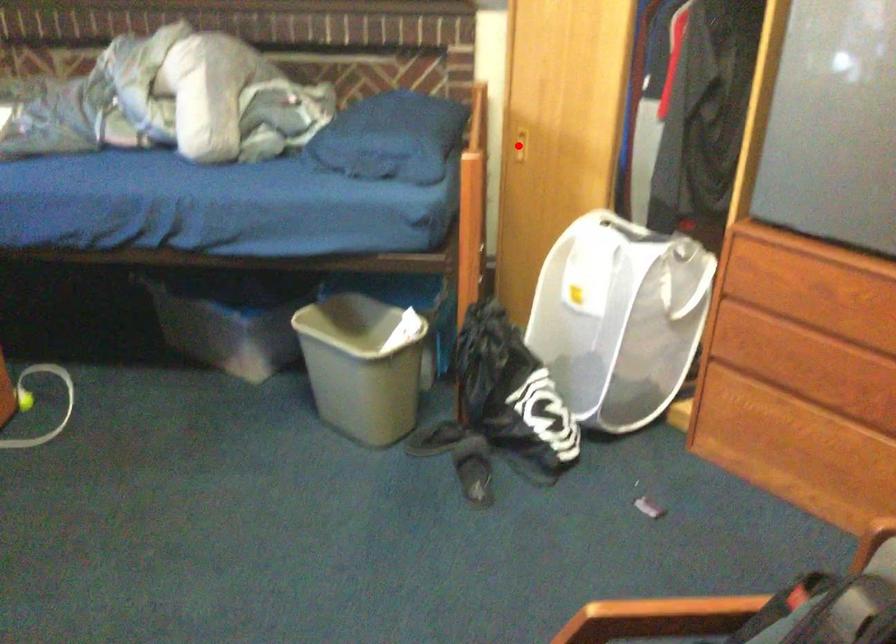
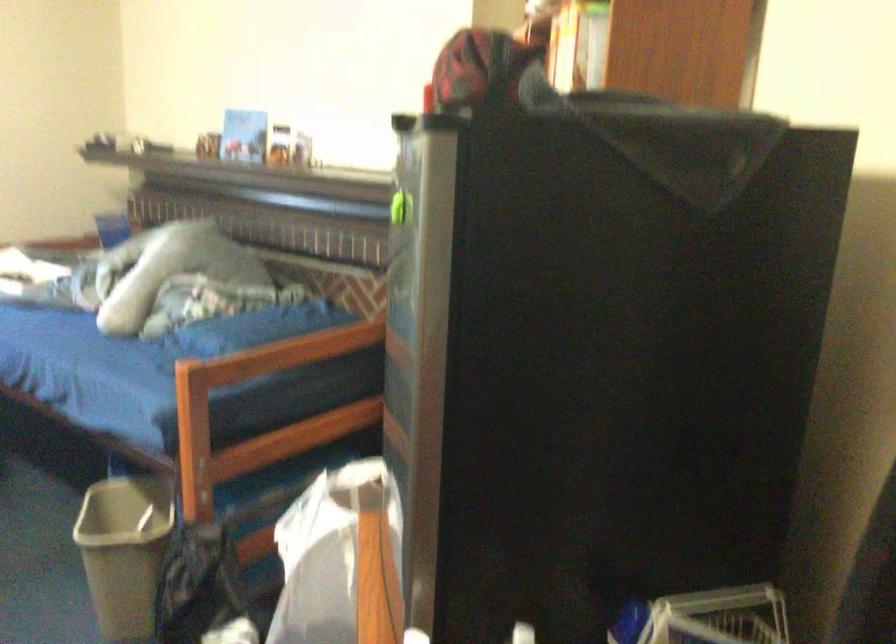
Question: I am providing you with two images of the same scene from different viewpoints. A red point is marked on the first image. Is the red point's position out of view in image 2?

Choices:
 (A) Yes
 (B) No

Answer: (A)